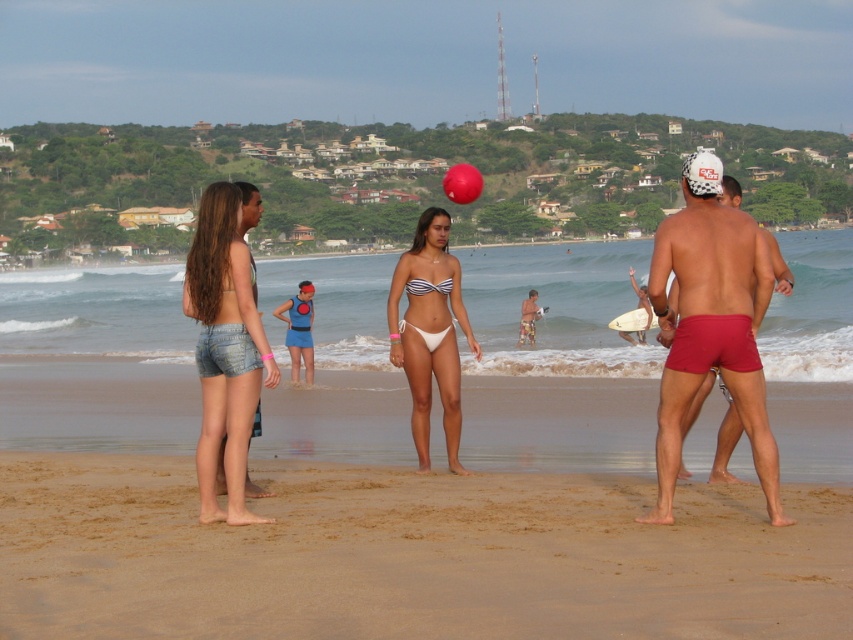
Is brown sandy beach at lower center behind red matte shorts at center?

No, brown sandy beach at lower center is in front of red matte shorts at center.

Between brown sandy beach at lower center and red matte shorts at center, which one has more height?

red matte shorts at center is taller.

Locate an element on the screen. brown sandy beach at lower center is located at coordinates (409, 556).

What are the coordinates of `brown sandy beach at lower center` in the screenshot? It's located at (409, 556).

Is white matte bikini at center smaller than rubber volleyball at center?

Correct, white matte bikini at center occupies less space than rubber volleyball at center.

Is point (405, 268) closer to camera compared to point (462, 164)?

Yes, point (405, 268) is closer to viewer.

The image size is (853, 640). Identify the location of white matte bikini at center. (430, 332).

Consider the image. Does red matte shorts at center have a lesser height compared to white matte bikini at center?

No.

Does point (721, 273) lie in front of point (442, 371)?

Yes, it is.

The image size is (853, 640). I want to click on red matte shorts at center, so click(x=711, y=324).